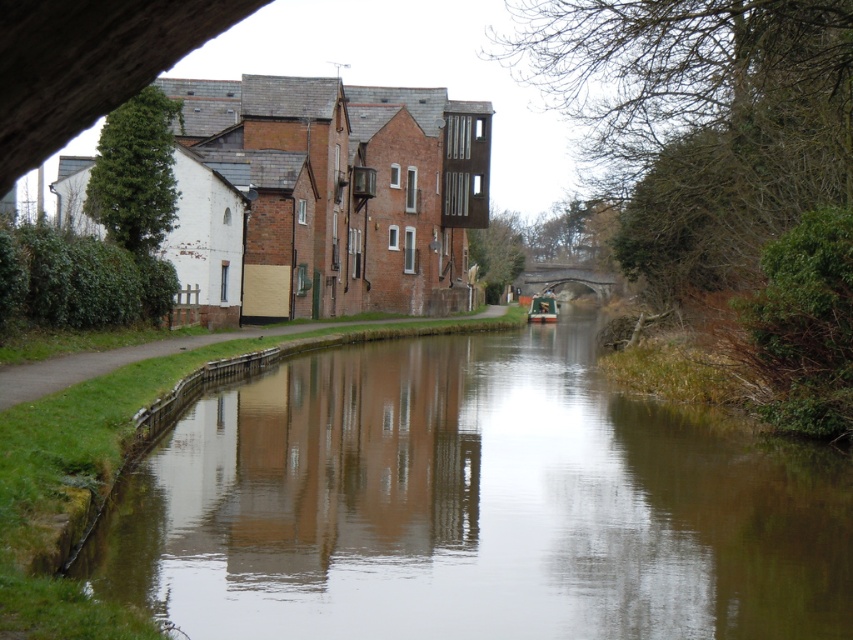
What do you see at coordinates (474, 504) in the screenshot? I see `smooth brown water at center` at bounding box center [474, 504].

Who is taller, smooth brown water at center or green matte boat at center?

Standing taller between the two is green matte boat at center.

At what (x,y) coordinates should I click in order to perform the action: click on smooth brown water at center. Please return your answer as a coordinate pair (x, y). Image resolution: width=853 pixels, height=640 pixels. Looking at the image, I should click on (474, 504).

Can you confirm if smooth brown water at center is positioned above stone arch bridge at center?

Incorrect, smooth brown water at center is not positioned above stone arch bridge at center.

Does smooth brown water at center appear under stone arch bridge at center?

Indeed, smooth brown water at center is positioned under stone arch bridge at center.

Where is `smooth brown water at center`? The width and height of the screenshot is (853, 640). smooth brown water at center is located at coordinates (474, 504).

Is point (563, 275) closer to camera compared to point (546, 314)?

No, (563, 275) is behind (546, 314).

From the picture: Is stone arch bridge at center above green matte boat at center?

Correct, stone arch bridge at center is located above green matte boat at center.

Which is behind, point (601, 284) or point (538, 305)?

Positioned behind is point (601, 284).

This screenshot has width=853, height=640. What are the coordinates of `stone arch bridge at center` in the screenshot? It's located at (561, 278).